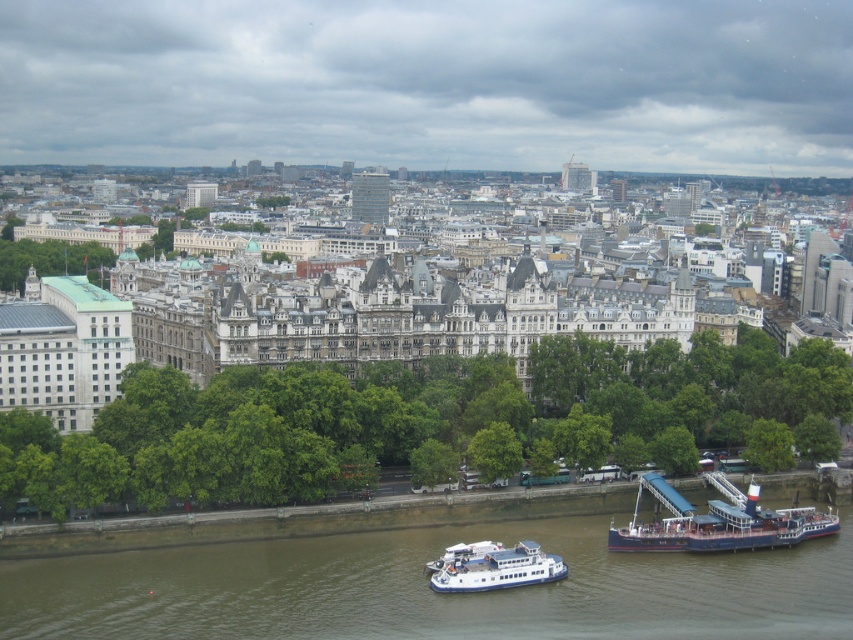
Based on the scene description, which object occupies more space in the image, the green leafy trees at center or the brown water at lower center?

The green leafy trees at center has a larger size compared to brown water at lower center, so it occupies more space in the image.

You are a tourist standing at the point marked by the coordinates point (418, 584). Looking around, you see brown water at lower center. What is the nearest object to you?

The nearest object to you is the brown water at lower center, as the point (418, 584) marks its location.

You are a photographer planning to capture the entire scene of the cityscape with both the brown water at lower center and the white glossy ferry at lower center in the frame. Considering their sizes, which object should you focus on to ensure both are clearly visible?

The brown water at lower center is larger in size compared to the white glossy ferry at lower center. To ensure both are clearly visible, focus on the brown water at lower center since it occupies more space in the frame, allowing the smaller ferry to be captured alongside it.